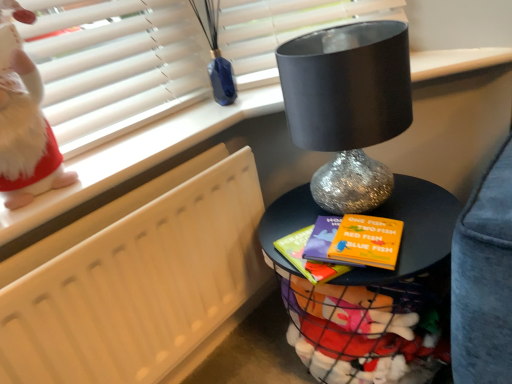
Question: Does point (291, 324) appear closer or farther from the camera than point (31, 173)?

Choices:
 (A) closer
 (B) farther

Answer: (B)

Question: Considering their positions, is shiny metallic table at center located in front of or behind white fluffy doll at upper left?

Choices:
 (A) front
 (B) behind

Answer: (B)

Question: Considering the real-world distances, which object is closest to the shiny metallic table at center?

Choices:
 (A) white fluffy doll at upper left
 (B) shiny metallic lamp at center
 (C) white matte radiator at left

Answer: (B)

Question: Which object is the farthest from the white fluffy doll at upper left?

Choices:
 (A) shiny metallic lamp at center
 (B) shiny metallic table at center
 (C) white matte radiator at left

Answer: (B)